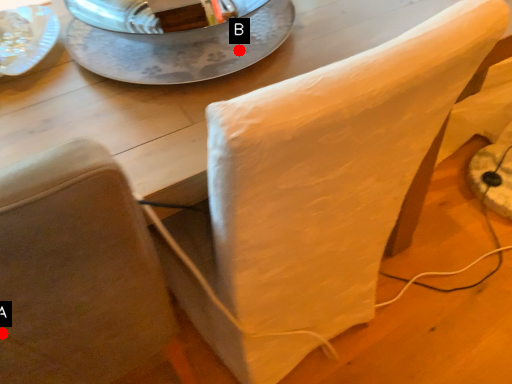
Question: Two points are circled on the image, labeled by A and B beside each circle. Which of the following is the closest to the observer?

Choices:
 (A) A is closer
 (B) B is closer

Answer: (A)